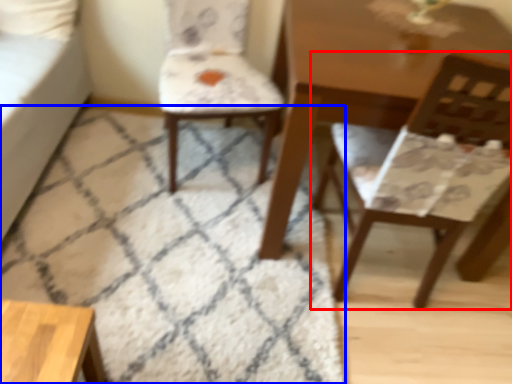
Question: Which object appears closest to the camera in this image, chair (highlighted by a red box) or mat (highlighted by a blue box)?

Choices:
 (A) chair
 (B) mat

Answer: (A)